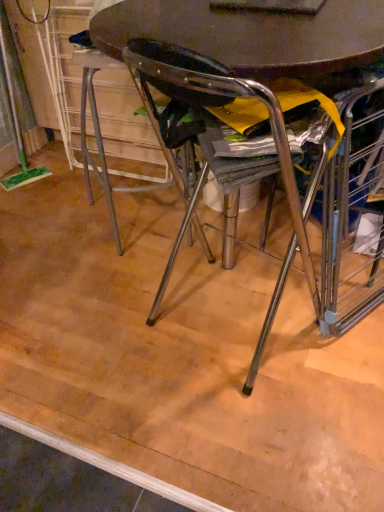
Question: Is matte wood floor at center taller or shorter than metallic brown table at center?

Choices:
 (A) tall
 (B) short

Answer: (B)

Question: Does point (297, 356) appear closer or farther from the camera than point (135, 30)?

Choices:
 (A) closer
 (B) farther

Answer: (B)

Question: Considering their positions, is matte wood floor at center located in front of or behind metallic brown table at center?

Choices:
 (A) behind
 (B) front

Answer: (A)

Question: Does point (370, 37) appear closer or farther from the camera than point (97, 198)?

Choices:
 (A) closer
 (B) farther

Answer: (A)

Question: In the image, is metallic brown table at center positioned in front of or behind matte wood floor at center?

Choices:
 (A) behind
 (B) front

Answer: (B)

Question: Is metallic brown table at center wider or thinner than matte wood floor at center?

Choices:
 (A) thin
 (B) wide

Answer: (A)

Question: Is metallic brown table at center bigger or smaller than matte wood floor at center?

Choices:
 (A) small
 (B) big

Answer: (B)